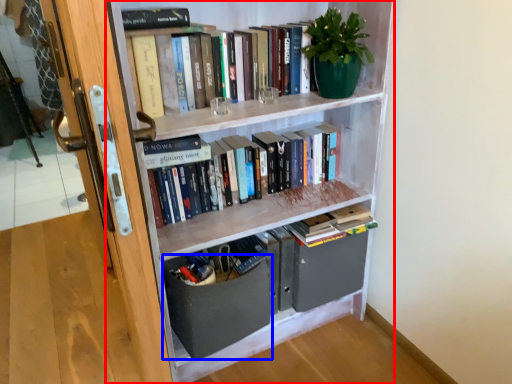
Question: Which of the following is the closest to the observer, bookcase (highlighted by a red box) or drawer (highlighted by a blue box)?

Choices:
 (A) bookcase
 (B) drawer

Answer: (A)